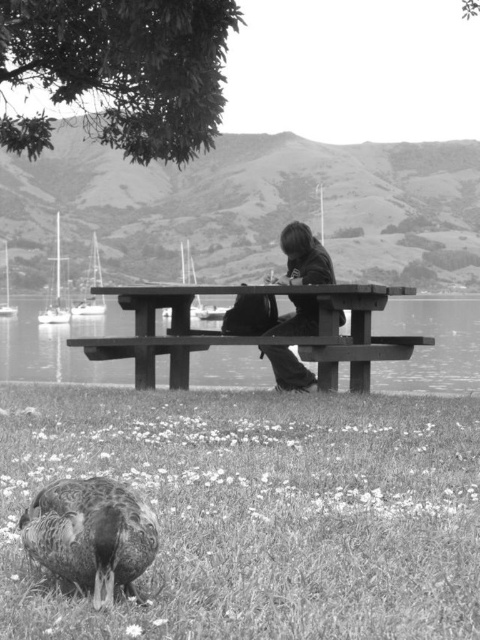
Question: Can you confirm if wooden picnic table at center is thinner than dark brown textured duck at lower left?

Choices:
 (A) no
 (B) yes

Answer: (A)

Question: Which of the following is the farthest from the observer?

Choices:
 (A) (108, 598)
 (B) (266, 312)

Answer: (B)

Question: Does wooden picnic table at center appear under dark brown leather jacket at center?

Choices:
 (A) no
 (B) yes

Answer: (B)

Question: Does wooden picnic table at center appear on the left side of dark brown leather jacket at center?

Choices:
 (A) yes
 (B) no

Answer: (A)

Question: Which point is closer to the camera?

Choices:
 (A) (48, 545)
 (B) (296, 250)
 (C) (180, 292)

Answer: (A)

Question: Which object is the closest to the wooden picnic table at center?

Choices:
 (A) dark brown leather jacket at center
 (B) dark brown textured duck at lower left

Answer: (A)